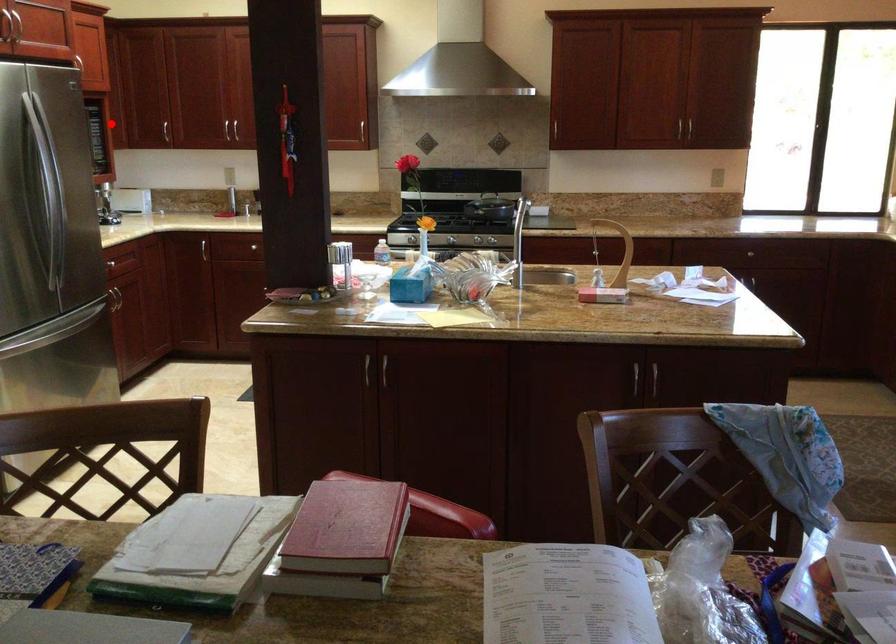
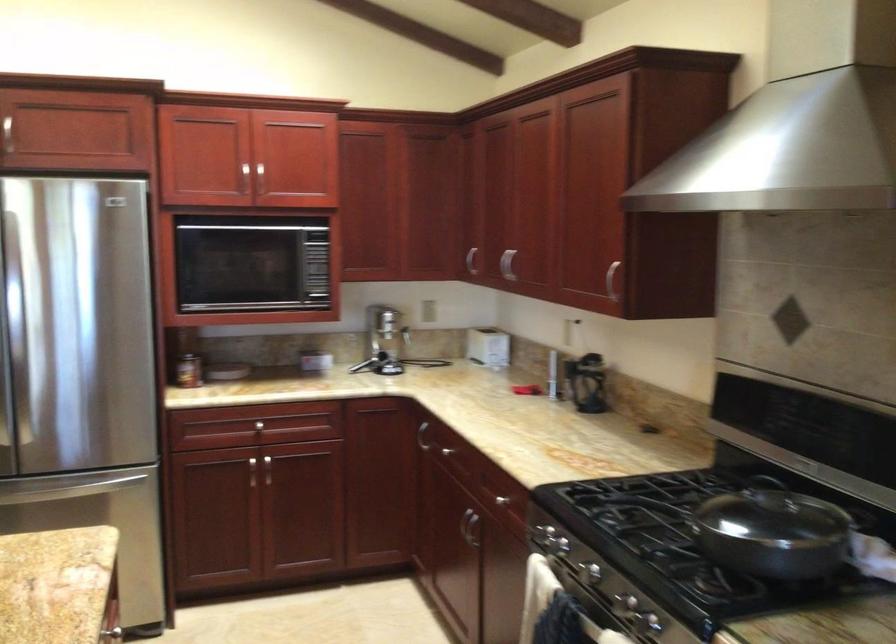
Question: I am providing you with two images of the same scene from different viewpoints. Given a red point in image1, look at the same physical point in image2. Is it:

Choices:
 (A) Closer to the viewpoint
 (B) Farther from the viewpoint

Answer: (A)